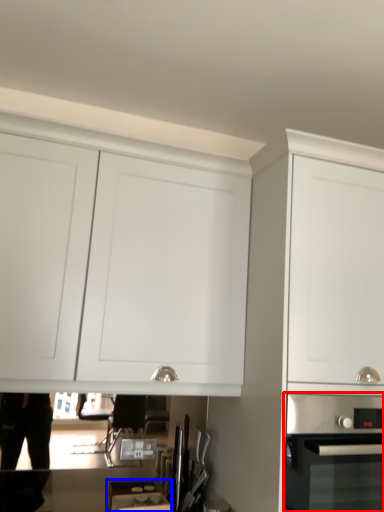
Question: Which point is further to the camera, home appliance (highlighted by a red box) or appliance (highlighted by a blue box)?

Choices:
 (A) home appliance
 (B) appliance

Answer: (B)